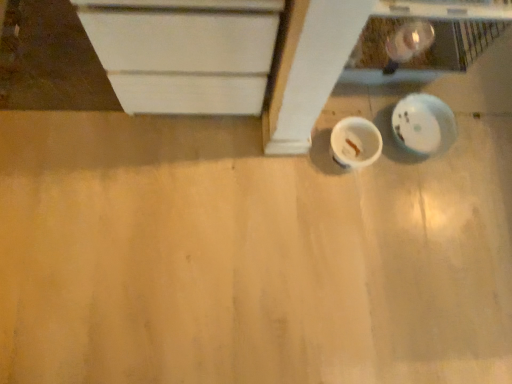
Locate an element on the screen. free point behind white matte cup at center is located at coordinates (364, 96).